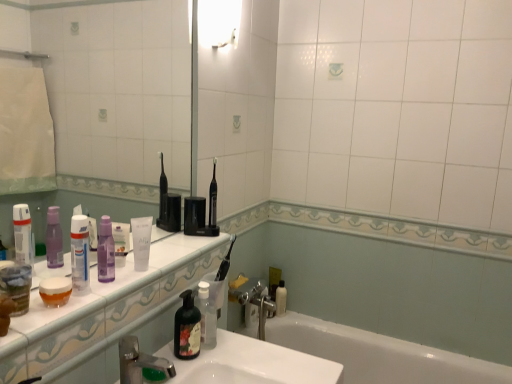
The image size is (512, 384). Find the location of `vacant region to the right of translucent plastic soap dispenser at lower center, the 2th toiletry viewed from the right`. vacant region to the right of translucent plastic soap dispenser at lower center, the 2th toiletry viewed from the right is located at coordinates (253, 355).